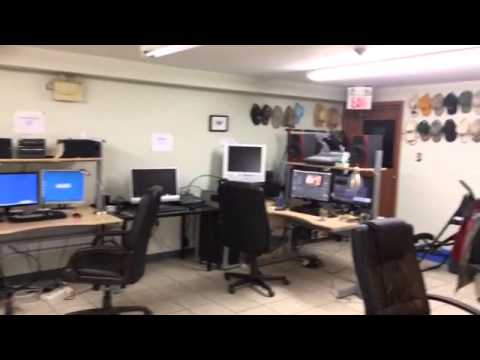
Locate an element on the screen. The height and width of the screenshot is (360, 480). walls is located at coordinates (193, 157), (433, 181).